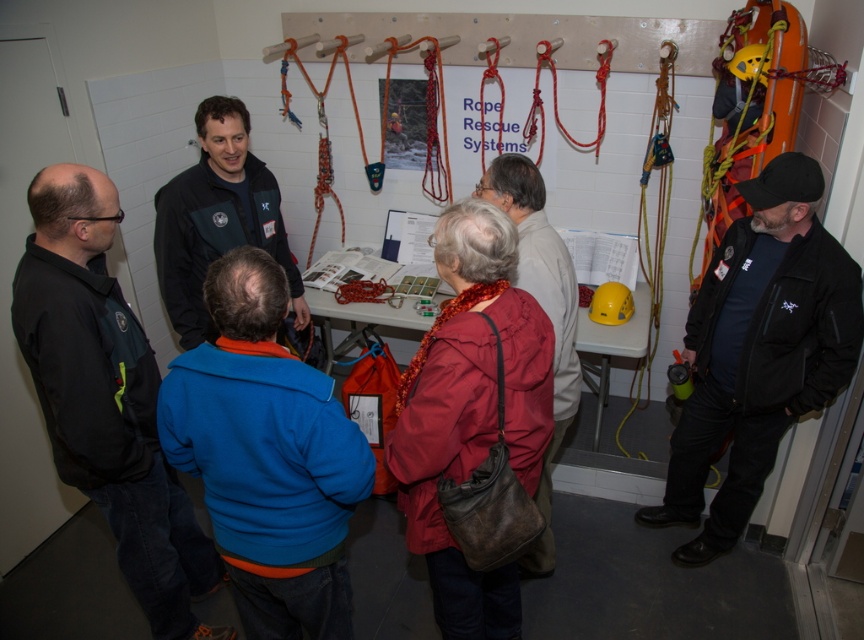
Question: Observing the image, what is the correct spatial positioning of black leather jacket at right in reference to yellow matte helmet at center?

Choices:
 (A) below
 (B) above

Answer: (A)

Question: From the image, what is the correct spatial relationship of blue fleece jacket at center in relation to black leather jacket at right?

Choices:
 (A) right
 (B) left

Answer: (B)

Question: Which object appears closest to the camera in this image?

Choices:
 (A) black matte jacket at center
 (B) red matte jacket at center
 (C) black leather jacket at right

Answer: (B)

Question: Among these objects, which one is nearest to the camera?

Choices:
 (A) red matte jacket at center
 (B) leather handbag at center
 (C) black jacket at left

Answer: (A)

Question: Which object appears closest to the camera in this image?

Choices:
 (A) red matte jacket at center
 (B) leather handbag at center

Answer: (A)

Question: Is blue fleece jacket at center behind black matte jacket at center?

Choices:
 (A) no
 (B) yes

Answer: (A)